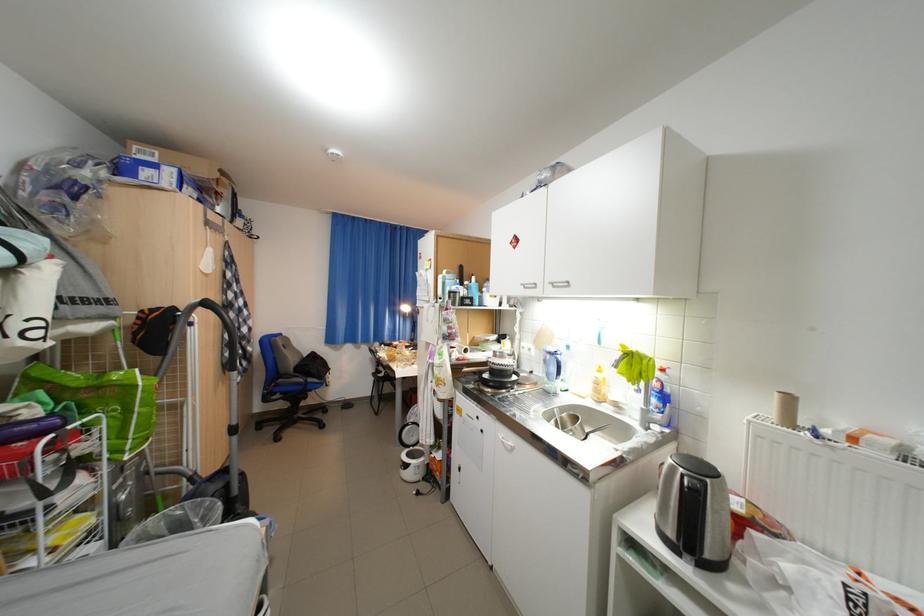
Where would you push the vacuum cleaner handle? Please return your answer as a coordinate pair (x, y).

(210, 341)